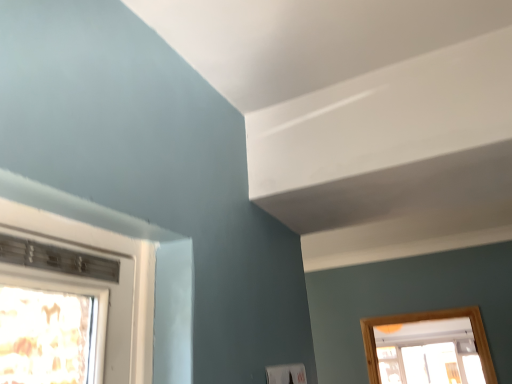
Question: Should I look upward or downward to see transparent glass window at lower right?

Choices:
 (A) down
 (B) up

Answer: (A)